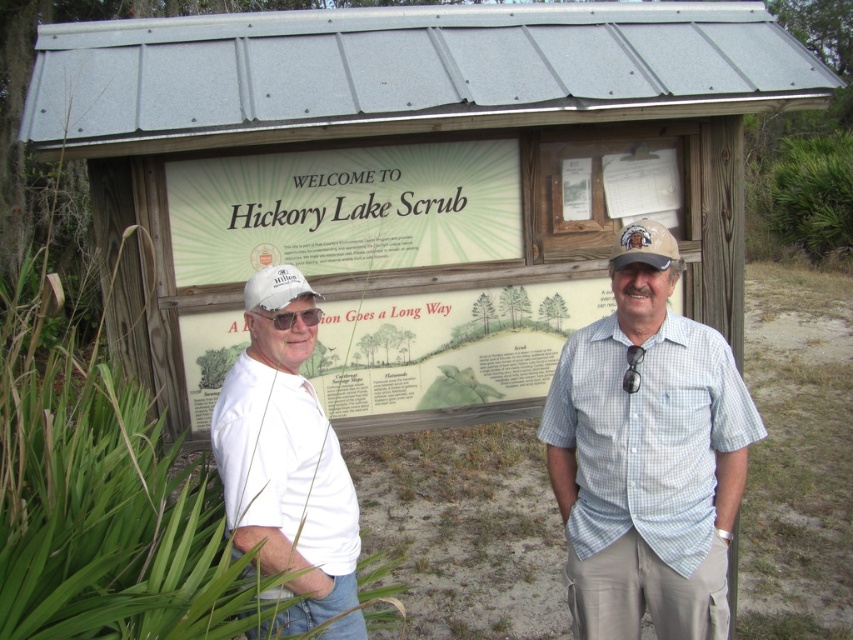
Question: Which point is farther to the camera?

Choices:
 (A) matte black goggles at center
 (B) light blue checkered shirt at center
 (C) matte white goggles at center

Answer: (A)

Question: Is wooden signboard at center wider than light blue checkered shirt at center?

Choices:
 (A) no
 (B) yes

Answer: (B)

Question: Among these objects, which one is nearest to the camera?

Choices:
 (A) light blue checkered shirt at center
 (B) white matte baseball cap at left
 (C) white matte shirt at left
 (D) tan fabric baseball cap at upper center

Answer: (C)

Question: Which point appears closest to the camera in this image?

Choices:
 (A) (633, 248)
 (B) (59, 115)
 (C) (553, 396)
 (D) (318, 308)

Answer: (A)

Question: Can you confirm if wooden signboard at center is bigger than matte black goggles at center?

Choices:
 (A) no
 (B) yes

Answer: (B)

Question: Does wooden signboard at center come behind matte black goggles at center?

Choices:
 (A) no
 (B) yes

Answer: (A)